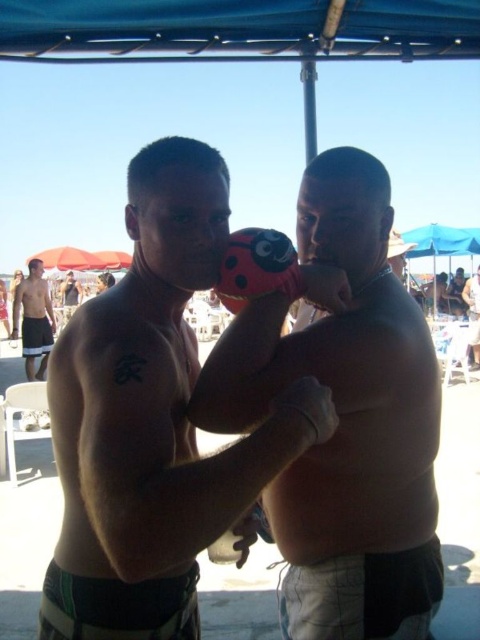
You are a photographer standing at the camera position. You want to take a closeup of the matte black boxing glove at center without including any people in the photo. Is the distance between you and the boxing glove sufficient to avoid including the men in the background?

The matte black boxing glove at center is 1.10 meters from the camera. Since the men are standing under the canopy where the boxing glove is placed, the distance may not be enough to exclude them from the photo. Move closer to the glove or adjust your angle to frame it without the men.

You are a photographer at the beach scene. You need to position two boxing gloves for a photo shoot. The scene has a man on the left and a man on the right. Where should you place the matte black boxing glove at center and the pink matte boxing glove at center so that they are aligned with the men while maintaining their spatial relationship?

Place the matte black boxing glove at center to the left of the pink matte boxing glove at center. Position them between the two men so the black one is closer to the man on the left and the pink one is closer to the man on the right, maintaining their left to right order.

You are a photographer taking a picture of two men under a blue canopy at a beach. You want to focus on the point closer to you. Which coordinate point should you choose, point (183, 444) or point (289, 376)?

Point (183, 444) is further to the viewer than point (289, 376), so you should choose point (183, 444) to focus on the closer point.